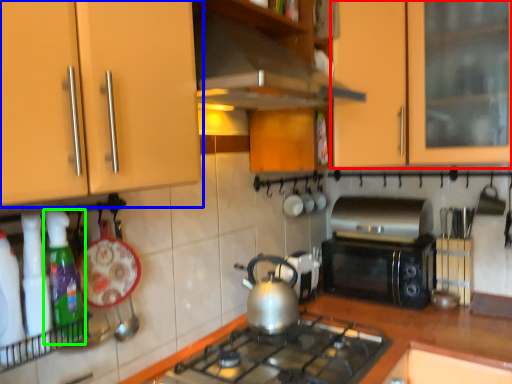
Question: Estimate the real-world distances between objects in this image. Which object is farther from cabinetry (highlighted by a red box), cabinetry (highlighted by a blue box) or kitchen appliance (highlighted by a green box)?

Choices:
 (A) cabinetry
 (B) kitchen appliance

Answer: (B)